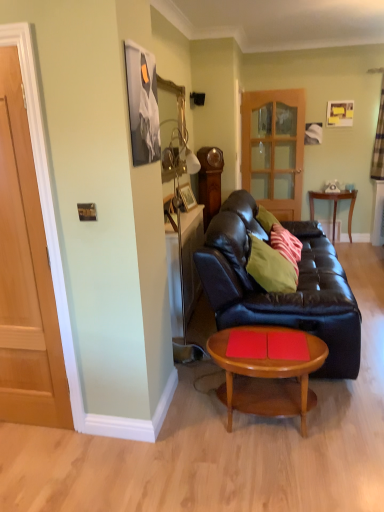
Find the location of a particular element. Image resolution: width=384 pixels, height=512 pixels. vacant space in front of light brown wooden coffee table at center is located at coordinates (276, 475).